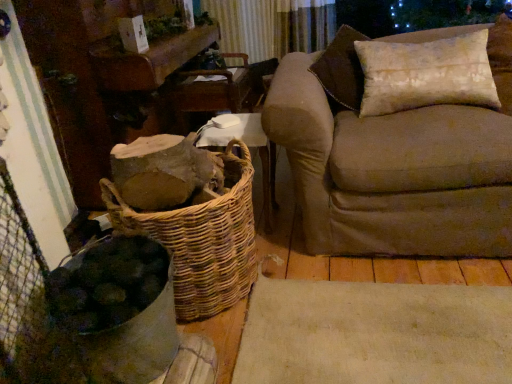
Question: Should I look upward or downward to see woven brown basket at lower left?

Choices:
 (A) down
 (B) up

Answer: (A)

Question: Is woven brown basket at lower left not inside beige fabric couch at right?

Choices:
 (A) yes
 (B) no

Answer: (A)

Question: Considering the relative sizes of woven brown basket at lower left and beige fabric couch at right in the image provided, is woven brown basket at lower left taller than beige fabric couch at right?

Choices:
 (A) no
 (B) yes

Answer: (A)

Question: Is woven brown basket at lower left looking in the opposite direction of beige fabric couch at right?

Choices:
 (A) no
 (B) yes

Answer: (A)

Question: Does woven brown basket at lower left have a smaller size compared to beige fabric couch at right?

Choices:
 (A) yes
 (B) no

Answer: (A)

Question: Could beige fabric couch at right be considered to be inside woven brown basket at lower left?

Choices:
 (A) yes
 (B) no

Answer: (B)

Question: Is woven brown basket at lower left next to beige fabric couch at right?

Choices:
 (A) no
 (B) yes

Answer: (A)

Question: Does beige fabric couch at right have a lesser width compared to woven wood basket at center?

Choices:
 (A) yes
 (B) no

Answer: (B)

Question: From a real-world perspective, is beige fabric couch at right physically below woven wood basket at center?

Choices:
 (A) yes
 (B) no

Answer: (B)

Question: Is beige fabric couch at right taller than woven wood basket at center?

Choices:
 (A) no
 (B) yes

Answer: (B)

Question: Is woven wood basket at center at the back of beige fabric couch at right?

Choices:
 (A) no
 (B) yes

Answer: (A)

Question: Considering the relative sizes of beige fabric couch at right and woven wood basket at center in the image provided, is beige fabric couch at right shorter than woven wood basket at center?

Choices:
 (A) yes
 (B) no

Answer: (B)

Question: Is beige fabric couch at right closer to the viewer compared to woven wood basket at center?

Choices:
 (A) yes
 (B) no

Answer: (A)

Question: Are woven wood basket at center and wooden armchair at center making contact?

Choices:
 (A) no
 (B) yes

Answer: (A)